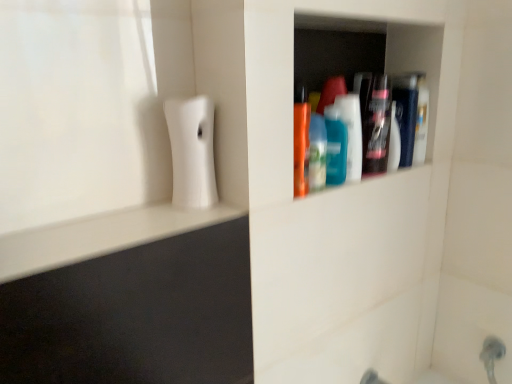
Question: Considering the relative sizes of translucent blue bottle at center, positioned as the third mouthwash in right-to-left order, and teal glossy mouthwash at center, which is the 2th mouthwash in right-to-left order, in the image provided, is translucent blue bottle at center, positioned as the third mouthwash in right-to-left order, taller than teal glossy mouthwash at center, which is the 2th mouthwash in right-to-left order,?

Choices:
 (A) no
 (B) yes

Answer: (A)

Question: Does translucent blue bottle at center, positioned as the third mouthwash in right-to-left order, appear on the left side of teal glossy mouthwash at center, the second mouthwash when ordered from left to right?

Choices:
 (A) yes
 (B) no

Answer: (A)

Question: Considering the relative sizes of translucent blue bottle at center, placed as the 1th mouthwash when sorted from left to right, and teal glossy mouthwash at center, which is the 2th mouthwash in right-to-left order, in the image provided, is translucent blue bottle at center, placed as the 1th mouthwash when sorted from left to right, smaller than teal glossy mouthwash at center, which is the 2th mouthwash in right-to-left order,?

Choices:
 (A) no
 (B) yes

Answer: (B)

Question: Is the position of translucent blue bottle at center, placed as the 1th mouthwash when sorted from left to right, less distant than that of teal glossy mouthwash at center, the second mouthwash when ordered from left to right?

Choices:
 (A) yes
 (B) no

Answer: (A)

Question: From a real-world perspective, is translucent blue bottle at center, positioned as the third mouthwash in right-to-left order, under teal glossy mouthwash at center, the second mouthwash when ordered from left to right?

Choices:
 (A) no
 (B) yes

Answer: (B)

Question: Can we say translucent blue bottle at center, positioned as the third mouthwash in right-to-left order, lies outside teal glossy mouthwash at center, which is the 2th mouthwash in right-to-left order?

Choices:
 (A) yes
 (B) no

Answer: (A)

Question: From a real-world perspective, is teal glossy mouthwash at center, the second mouthwash when ordered from left to right, positioned under translucent blue bottle at center, positioned as the third mouthwash in right-to-left order, based on gravity?

Choices:
 (A) no
 (B) yes

Answer: (A)

Question: Does teal glossy mouthwash at center, which is the 2th mouthwash in right-to-left order, have a greater width compared to translucent blue bottle at center, placed as the 1th mouthwash when sorted from left to right?

Choices:
 (A) no
 (B) yes

Answer: (A)

Question: Is teal glossy mouthwash at center, the second mouthwash when ordered from left to right, placed right next to translucent blue bottle at center, placed as the 1th mouthwash when sorted from left to right?

Choices:
 (A) yes
 (B) no

Answer: (A)

Question: Considering the relative positions of teal glossy mouthwash at center, which is the 2th mouthwash in right-to-left order, and translucent blue bottle at center, positioned as the third mouthwash in right-to-left order, in the image provided, is teal glossy mouthwash at center, which is the 2th mouthwash in right-to-left order, in front of translucent blue bottle at center, positioned as the third mouthwash in right-to-left order,?

Choices:
 (A) no
 (B) yes

Answer: (A)

Question: Would you consider teal glossy mouthwash at center, the second mouthwash when ordered from left to right, to be distant from translucent blue bottle at center, placed as the 1th mouthwash when sorted from left to right?

Choices:
 (A) no
 (B) yes

Answer: (A)

Question: Is teal glossy mouthwash at center, which is the 2th mouthwash in right-to-left order, outside translucent blue bottle at center, positioned as the third mouthwash in right-to-left order?

Choices:
 (A) yes
 (B) no

Answer: (A)

Question: Is translucent plastic mouthwash at upper right, the third mouthwash when ordered from left to right, taller than translucent blue bottle at center, placed as the 1th mouthwash when sorted from left to right?

Choices:
 (A) no
 (B) yes

Answer: (B)